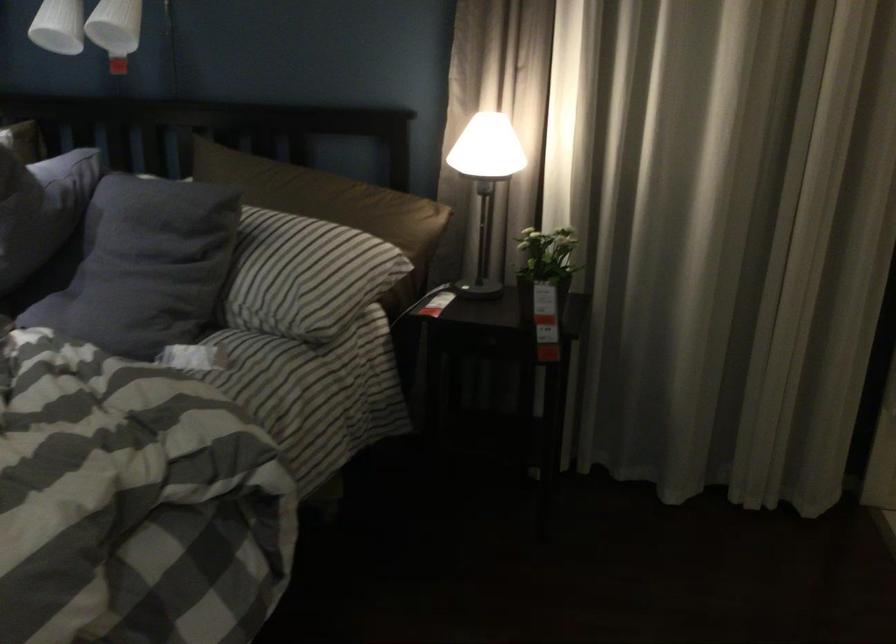
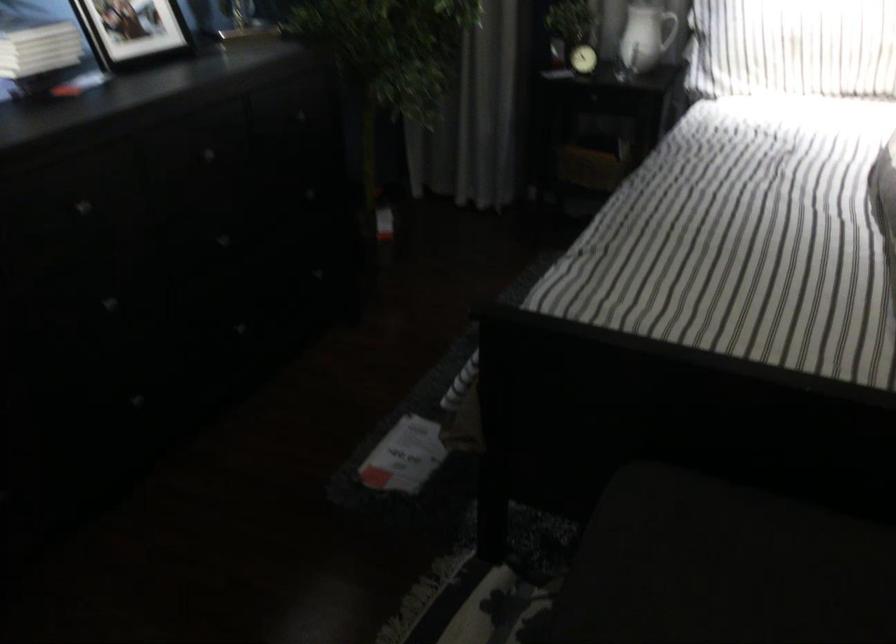
Question: The images are taken continuously from a first-person perspective. In which direction are you moving?

Choices:
 (A) Left
 (B) Right
 (C) Forward
 (D) Backward

Answer: (A)